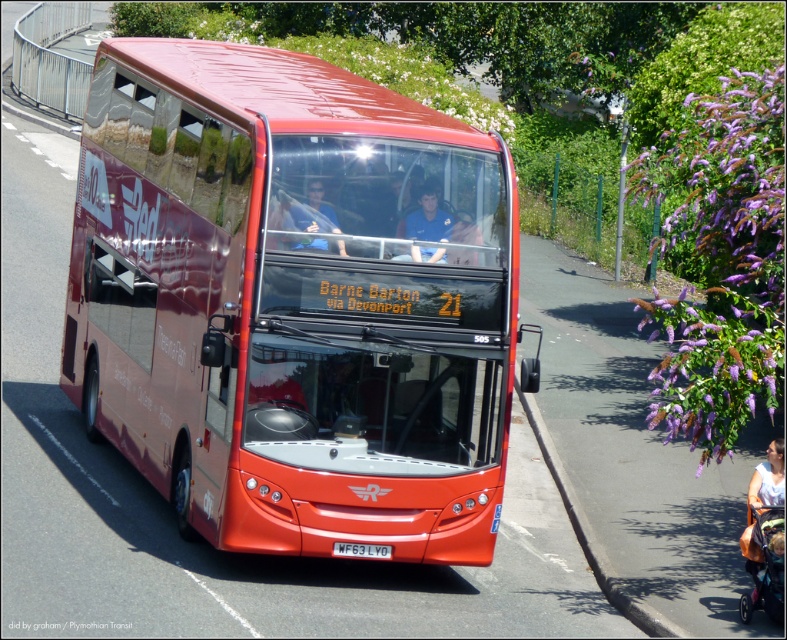
You are a pedestrian standing at the edge of the road where the white fabric person at lower right is located. You want to cross the road to reach the white plastic license plate at center. The bus is moving towards you. Is the distance between you and the license plate sufficient for you to safely cross before the bus arrives?

The white fabric person at lower right is 3.69 meters away from the white plastic license plate at center. However, the bus is moving towards you, so the distance may not be sufficient to safely cross before the bus arrives. It is recommended to wait for a safer opportunity.

You are a pedestrian standing on the sidewalk next to the road where the red double decker bus is driving. You see a matte black shirt at center and a white fabric person at lower right. Which of these two people is shorter?

The matte black shirt at center has a lesser height compared to the white fabric person at lower right, so the person wearing the matte black shirt at center is shorter.